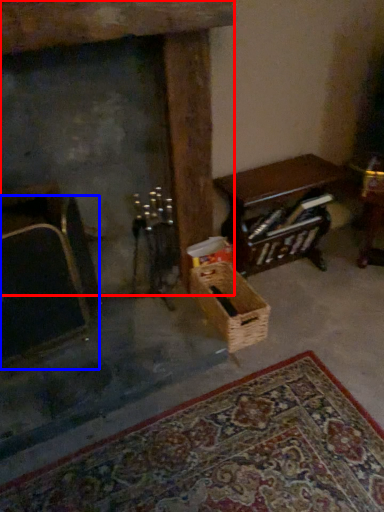
Question: Which object is closer to the camera taking this photo, fireplace (highlighted by a red box) or armchair (highlighted by a blue box)?

Choices:
 (A) fireplace
 (B) armchair

Answer: (A)